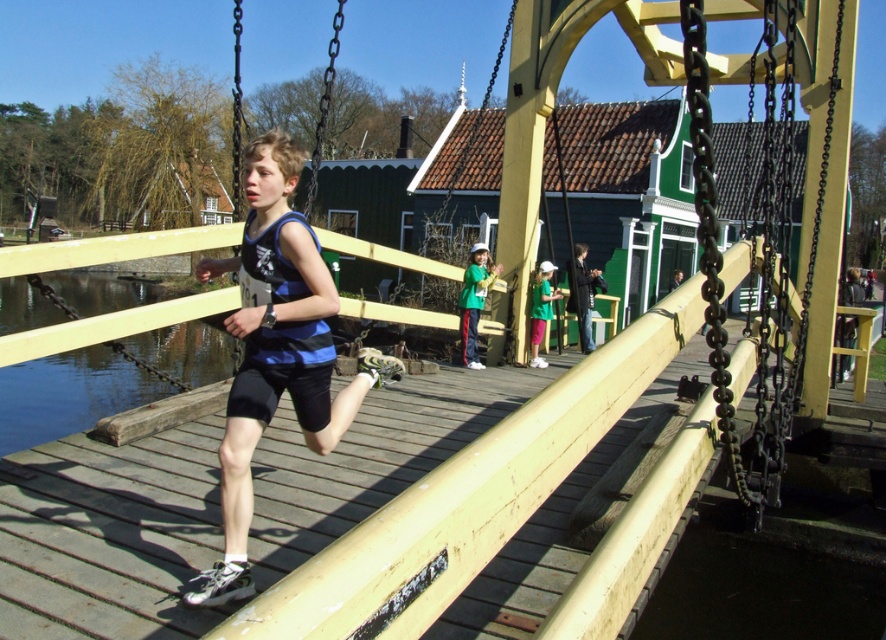
You are a photographer standing on the wooden bridge and see the dark blue fabric jacket at center and the green fabric cap at center in the background. Which object is bigger?

The dark blue fabric jacket at center is larger in size than the green fabric cap at center.

You are a photographer standing on the wooden bridge. You want to take a photo of the dark blue fabric jacket at center and the blue fabric shirt at center. The minimum distance between you and the objects must be 7 meters. Can you stand at the edge of the bridge to take the photo?

The dark blue fabric jacket at center and blue fabric shirt at center are 8.04 meters apart from each other. Since the minimum distance required is 7 meters, standing at the edge of the bridge allows you to maintain the required distance while capturing both objects in the frame.

You are a photographer standing on the wooden bridge. You notice two blue fabrics at the center of the scene. The dark blue fabric jacket at center and the blue fabric shirt at center. Which one is taller?

The dark blue fabric jacket at center is taller than the blue fabric shirt at center.